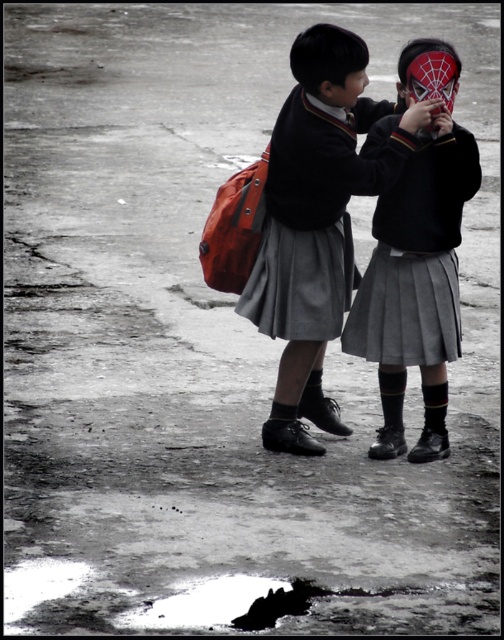
Question: Among these objects, which one is farthest from the camera?

Choices:
 (A) matte black school uniform at center
 (B) matte gray skirt at center

Answer: (B)

Question: Is matte black school uniform at center positioned at the back of matte gray skirt at center?

Choices:
 (A) no
 (B) yes

Answer: (A)

Question: Which object is farther from the camera taking this photo?

Choices:
 (A) matte black school uniform at center
 (B) matte gray skirt at center

Answer: (B)

Question: Is matte black school uniform at center to the right of matte gray skirt at center from the viewer's perspective?

Choices:
 (A) no
 (B) yes

Answer: (A)

Question: Is matte black school uniform at center further to the viewer compared to matte gray skirt at center?

Choices:
 (A) no
 (B) yes

Answer: (A)